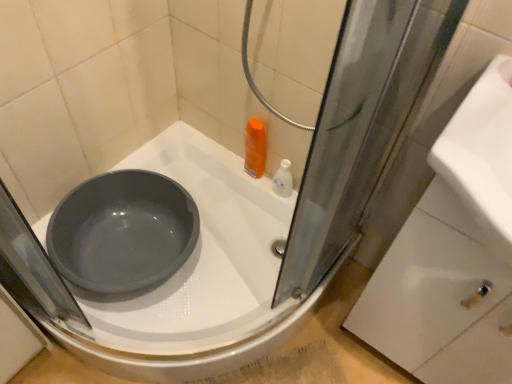
The height and width of the screenshot is (384, 512). What do you see at coordinates (205, 251) in the screenshot? I see `matte gray basin at center` at bounding box center [205, 251].

What are the coordinates of `white glossy bottle at upper right` in the screenshot? It's located at (283, 180).

Considering the relative sizes of white glossy bottle at upper right and white glossy drawer at lower right in the image provided, is white glossy bottle at upper right smaller than white glossy drawer at lower right?

Yes.

Looking at this image, is the depth of white glossy bottle at upper right less than that of white glossy drawer at lower right?

That is False.

Is point (275, 182) positioned before point (482, 370)?

No.

From a real-world perspective, is white glossy bottle at upper right physically above white glossy drawer at lower right?

No, from a real-world perspective, white glossy bottle at upper right is not over white glossy drawer at lower right

Would you say white glossy bottle at upper right is outside matte gray basin at center?

Yes, white glossy bottle at upper right is located beyond the bounds of matte gray basin at center.

This screenshot has width=512, height=384. Find the location of `bath that appears in front of the white glossy bottle at upper right`. bath that appears in front of the white glossy bottle at upper right is located at coordinates click(x=205, y=251).

Considering their positions, is white glossy bottle at upper right located in front of or behind matte gray basin at center?

Visually, white glossy bottle at upper right is located behind matte gray basin at center.

Is white glossy bottle at upper right aimed at matte gray basin at center?

No, white glossy bottle at upper right is not aimed at matte gray basin at center.

From a real-world perspective, between matte gray basin at center and white glossy drawer at lower right, who is vertically higher?

In real-world perspective, white glossy drawer at lower right is above.

Between matte gray basin at center and white glossy drawer at lower right, which one has smaller width?

Thinner between the two is white glossy drawer at lower right.

Considering the positions of objects matte gray basin at center and white glossy drawer at lower right in the image provided, who is more to the left, matte gray basin at center or white glossy drawer at lower right?

Positioned to the left is matte gray basin at center.

You are a GUI agent. You are given a task and a screenshot of the screen. Output one action in this format:
    pyautogui.click(x=<x>, y=<y>)
    Task: Click on the toiletry positioned vertically above the matte gray basin at center (from a real-world perspective)
    This screenshot has width=512, height=384.
    Given the screenshot: What is the action you would take?
    pyautogui.click(x=283, y=180)

Can you confirm if matte gray basin at center is positioned to the right of white glossy bottle at upper right?

No.

Which is in front, point (211, 159) or point (281, 166)?

The point (281, 166) is closer.

From the image's perspective, who appears lower, white glossy drawer at lower right or matte gray basin at center?

white glossy drawer at lower right appears lower in the image.

From their relative heights in the image, would you say white glossy drawer at lower right is taller or shorter than matte gray basin at center?

Clearly, white glossy drawer at lower right is taller compared to matte gray basin at center.

Does white glossy drawer at lower right appear on the right side of matte gray basin at center?

Indeed, white glossy drawer at lower right is positioned on the right side of matte gray basin at center.

In terms of size, does white glossy drawer at lower right appear bigger or smaller than matte gray basin at center?

Clearly, white glossy drawer at lower right is smaller in size than matte gray basin at center.

Is white glossy drawer at lower right next to white glossy bottle at upper right?

No, white glossy drawer at lower right is not next to white glossy bottle at upper right.

From the image's perspective, is white glossy drawer at lower right on top of white glossy bottle at upper right?

Actually, white glossy drawer at lower right appears below white glossy bottle at upper right in the image.

Is white glossy drawer at lower right oriented away from white glossy bottle at upper right?

white glossy drawer at lower right is not turned away from white glossy bottle at upper right.

Based on the photo, how much distance is there between white glossy drawer at lower right and white glossy bottle at upper right?

They are 22.45 inches apart.

Identify the location of toiletry on the left of white glossy drawer at lower right. (283, 180).

Image resolution: width=512 pixels, height=384 pixels. There is a matte gray basin at center. Find the location of `toiletry above it (from a real-world perspective)`. toiletry above it (from a real-world perspective) is located at coordinates (283, 180).

From the picture: Considering their positions, is matte gray basin at center positioned closer to white glossy bottle at upper right than white glossy drawer at lower right?

The object closer to white glossy bottle at upper right is matte gray basin at center.

Considering their positions, is white glossy drawer at lower right positioned further to white glossy bottle at upper right than matte gray basin at center?

white glossy drawer at lower right.

Considering their positions, is matte gray basin at center positioned closer to white glossy drawer at lower right than white glossy bottle at upper right?

Among the two, matte gray basin at center is located nearer to white glossy drawer at lower right.

From the image, which object appears to be nearer to matte gray basin at center, white glossy bottle at upper right or white glossy drawer at lower right?

white glossy bottle at upper right is closer to matte gray basin at center.

From the image, which object appears to be farther from white glossy drawer at lower right, white glossy bottle at upper right or matte gray basin at center?

white glossy bottle at upper right.

Estimate the real-world distances between objects in this image. Which object is further from matte gray basin at center, white glossy drawer at lower right or white glossy bottle at upper right?

Based on the image, white glossy drawer at lower right appears to be further to matte gray basin at center.

The height and width of the screenshot is (384, 512). Find the location of `toiletry between matte gray basin at center and white glossy drawer at lower right in the horizontal direction`. toiletry between matte gray basin at center and white glossy drawer at lower right in the horizontal direction is located at coordinates (283, 180).